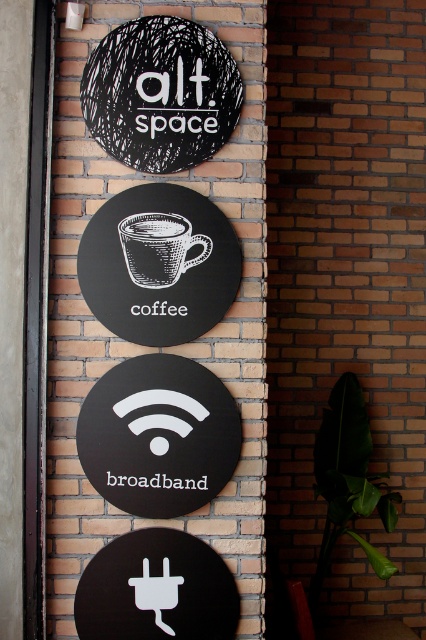
Question: Which point is farther to the camera?

Choices:
 (A) (209, 240)
 (B) (117, 173)

Answer: (A)

Question: Which point is farther to the camera?

Choices:
 (A) white textured coffee cup at center
 (B) black matte sign at center

Answer: (A)

Question: Which object appears closest to the camera in this image?

Choices:
 (A) white textured coffee cup at center
 (B) black matte sign at center

Answer: (B)

Question: Does black matte sign at center have a greater width compared to white textured coffee cup at center?

Choices:
 (A) no
 (B) yes

Answer: (B)

Question: Where is black matte sign at center located in relation to white textured coffee cup at center in the image?

Choices:
 (A) left
 (B) right

Answer: (A)

Question: Considering the relative positions of black matte sign at center and white textured coffee cup at center in the image provided, where is black matte sign at center located with respect to white textured coffee cup at center?

Choices:
 (A) above
 (B) below

Answer: (B)